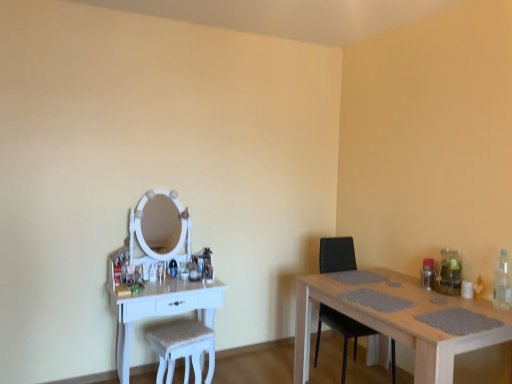
Question: From a real-world perspective, relative to black leather chair at right, is white fabric swivel chair at center vertically above or below?

Choices:
 (A) above
 (B) below

Answer: (B)

Question: Would you say white fabric swivel chair at center is inside or outside black leather chair at right?

Choices:
 (A) inside
 (B) outside

Answer: (B)

Question: Which is farther from the white fabric swivel chair at center?

Choices:
 (A) white wood table at left, which is the 1th table in left-to-right order
 (B) black leather chair at right
 (C) clear plastic bottle at right
 (D) light brown wooden table at right, which is the second table in left-to-right order

Answer: (C)

Question: Which object is the closest to the light brown wooden table at right, the 1th table from the right?

Choices:
 (A) white wood table at left, which is the 1th table in left-to-right order
 (B) clear plastic bottle at right
 (C) white fabric swivel chair at center
 (D) black leather chair at right

Answer: (B)